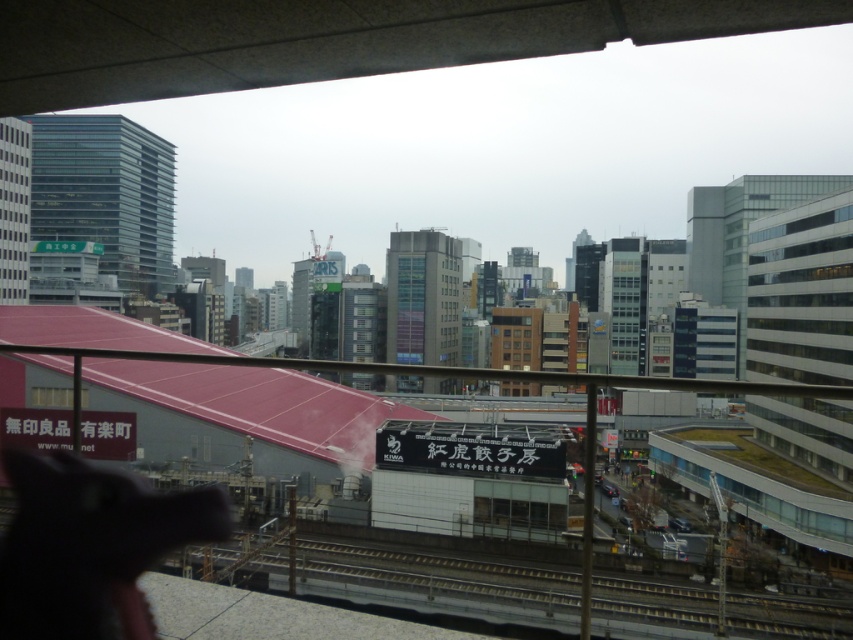
Can you confirm if concrete overpass at upper center is wider than metallic gray train track at lower center?

Incorrect, concrete overpass at upper center's width does not surpass metallic gray train track at lower center's.

Is point (106, 97) closer to viewer compared to point (608, 595)?

Yes, point (106, 97) is in front of point (608, 595).

In order to click on concrete overpass at upper center in this screenshot , I will do `click(328, 38)`.